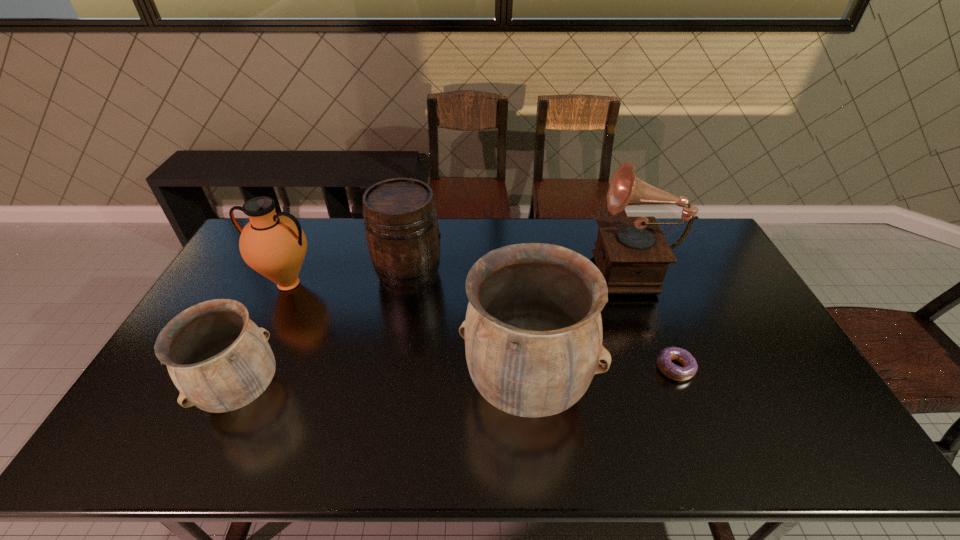
The image size is (960, 540). What are the coordinates of `object present at the near left corner` in the screenshot? It's located at (219, 359).

Where is `vacant space at the far edge of the desktop`? vacant space at the far edge of the desktop is located at coordinates (557, 232).

Where is `vacant point at the near edge`? The height and width of the screenshot is (540, 960). vacant point at the near edge is located at coordinates (382, 410).

Find the location of `vacant area at the right edge`. vacant area at the right edge is located at coordinates (797, 380).

This screenshot has width=960, height=540. I want to click on vacant space at the far right corner of the desktop, so click(x=682, y=227).

I want to click on vacant space in between the pitcher and the cider, so click(x=348, y=279).

Locate an element on the screen. Image resolution: width=960 pixels, height=540 pixels. vacant space that is in between the doughnut and the fifth tallest object is located at coordinates (459, 380).

Where is `empty space between the record player and the left urn`? Image resolution: width=960 pixels, height=540 pixels. empty space between the record player and the left urn is located at coordinates (437, 328).

You are a GUI agent. You are given a task and a screenshot of the screen. Output one action in this format:
    pyautogui.click(x=<x>, y=<y>)
    Task: Click on the vacant space that's between the pitcher and the third object from left to right
    This screenshot has width=960, height=540.
    Given the screenshot: What is the action you would take?
    pyautogui.click(x=348, y=279)

Where is `object that is the second closest to the pitcher`? object that is the second closest to the pitcher is located at coordinates (219, 359).